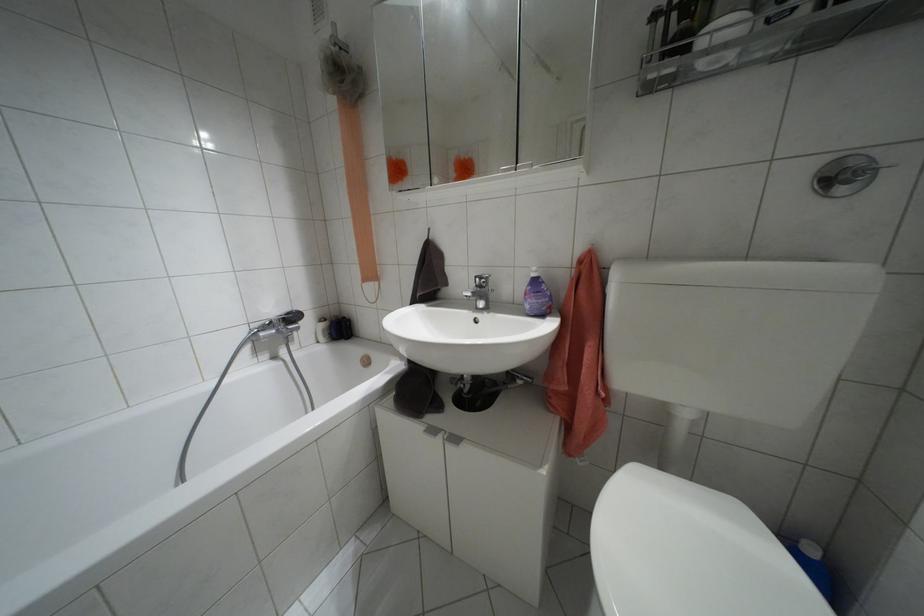
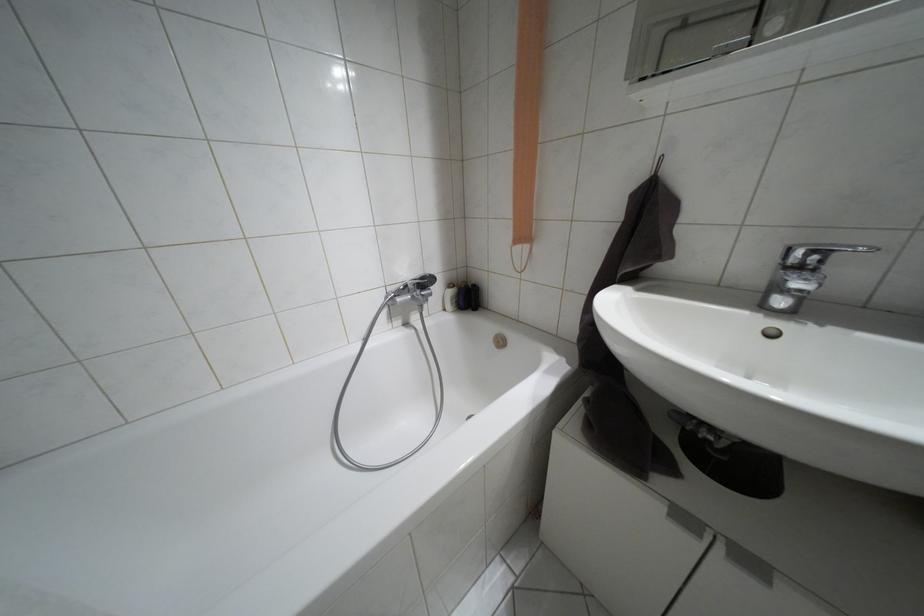
Question: The camera is either moving clockwise (left) or counter-clockwise (right) around the object. The first image is from the beginning of the video and the second image is from the end. Is the camera moving left or right when shooting the video?

Choices:
 (A) Left
 (B) Right

Answer: (B)